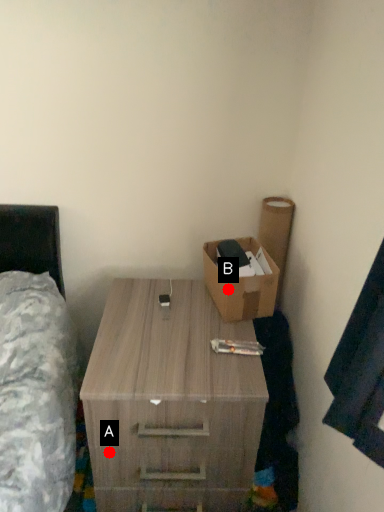
Question: Two points are circled on the image, labeled by A and B beside each circle. Which point is closer to the camera?

Choices:
 (A) A is closer
 (B) B is closer

Answer: (A)